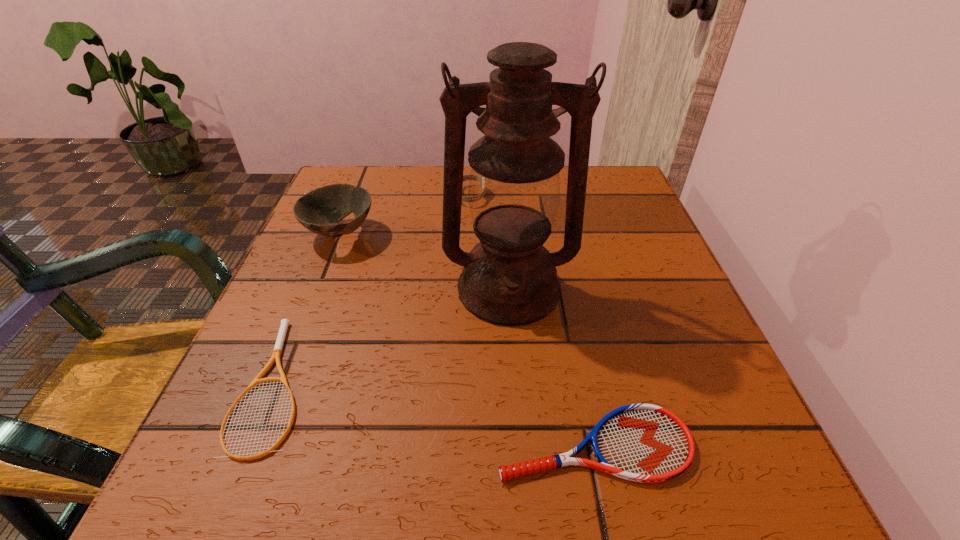
What are the coordinates of `oil lamp` in the screenshot? It's located at (509, 278).

Where is `the fourth shortest object`? The height and width of the screenshot is (540, 960). the fourth shortest object is located at coordinates (320, 210).

Identify the location of watch. (465, 177).

This screenshot has height=540, width=960. What are the coordinates of `the farthest object` in the screenshot? It's located at (465, 177).

This screenshot has width=960, height=540. I want to click on the taller tennis racket, so click(646, 443).

Where is `the second shortest object`? The height and width of the screenshot is (540, 960). the second shortest object is located at coordinates (646, 443).

This screenshot has width=960, height=540. I want to click on the shortest object, so click(x=277, y=351).

Locate an element on the screen. The width and height of the screenshot is (960, 540). the shorter tennis racket is located at coordinates (277, 351).

Locate an element on the screen. The image size is (960, 540). free space located 0.140m on the front of the oil lamp is located at coordinates (517, 401).

The image size is (960, 540). What are the coordinates of `free space located 0.370m on the right of the bowl` in the screenshot? It's located at (553, 234).